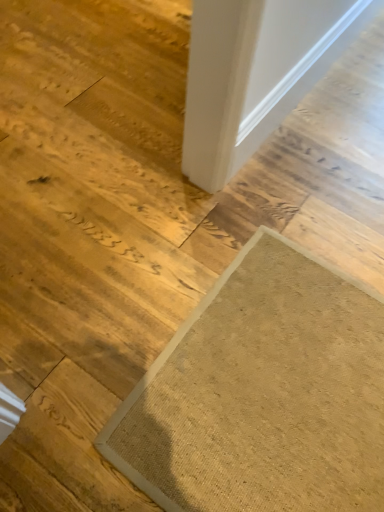
The width and height of the screenshot is (384, 512). Find the location of `empty space that is ontop of textured beige mat at lower right`. empty space that is ontop of textured beige mat at lower right is located at coordinates (286, 381).